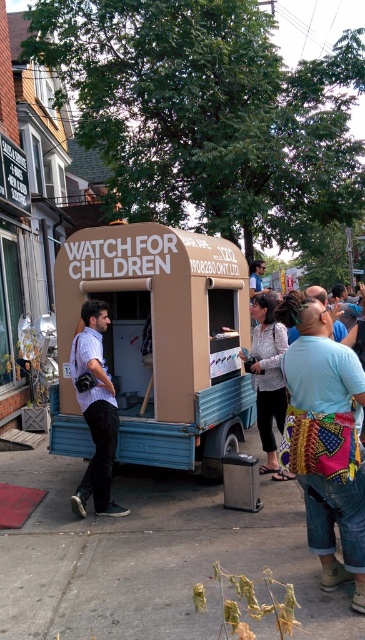
You are a delivery person who needs to place a small box on the concrete sidewalk at lower center without blocking the blue denim jeans at lower right. Considering their sizes, can you fit the box on the sidewalk while keeping it away from the jeans?

The concrete sidewalk at lower center is wider than the blue denim jeans at lower right, so yes, you can place the box on the sidewalk while keeping it away from the jeans.